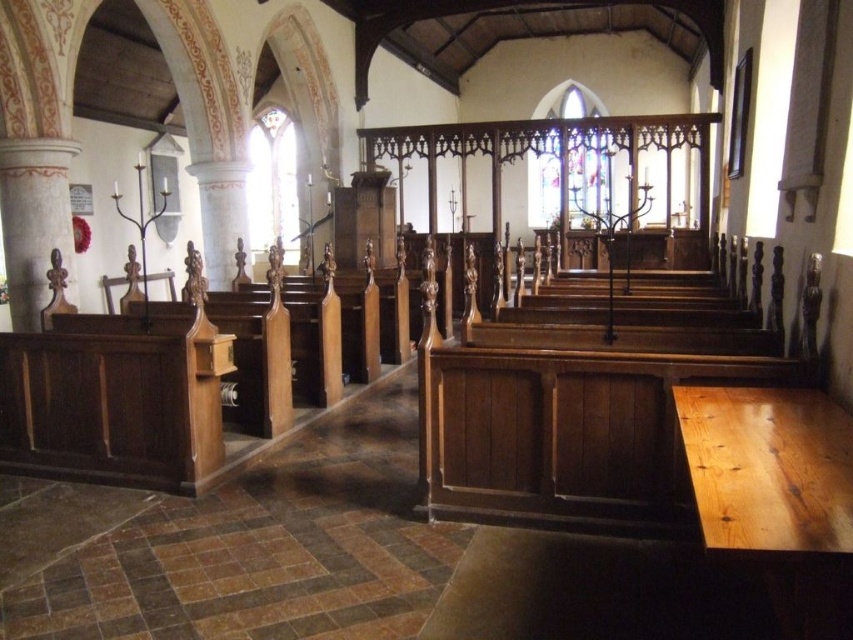
Who is positioned more to the left, stained glass at center or clear stained glass window at upper left?

Positioned to the left is clear stained glass window at upper left.

Does stained glass at center lie in front of clear stained glass window at upper left?

Yes, it is.

This screenshot has width=853, height=640. I want to click on stained glass at center, so click(587, 172).

The image size is (853, 640). I want to click on stained glass at center, so click(x=587, y=172).